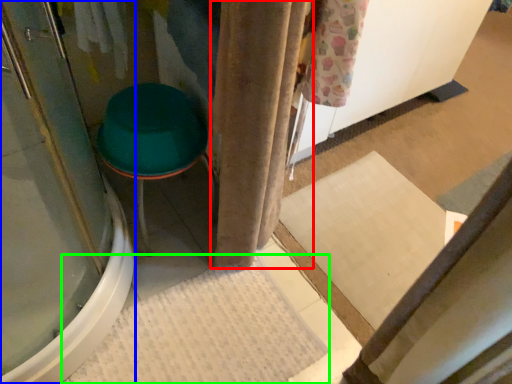
Question: Which object is positioned farthest from curtain (highlighted by a red box)? Select from screen door (highlighted by a blue box) and bath mat (highlighted by a green box).

Choices:
 (A) screen door
 (B) bath mat

Answer: (A)